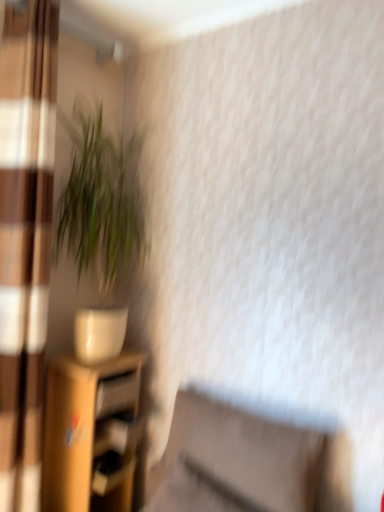
Question: From a real-world perspective, is green leafy plant at left under wooden shelf at lower left?

Choices:
 (A) no
 (B) yes

Answer: (A)

Question: From the image's perspective, does green leafy plant at left appear higher than wooden shelf at lower left?

Choices:
 (A) yes
 (B) no

Answer: (A)

Question: Is green leafy plant at left to the left of wooden shelf at lower left from the viewer's perspective?

Choices:
 (A) yes
 (B) no

Answer: (B)

Question: Is green leafy plant at left outside of wooden shelf at lower left?

Choices:
 (A) no
 (B) yes

Answer: (B)

Question: Is green leafy plant at left looking in the opposite direction of wooden shelf at lower left?

Choices:
 (A) no
 (B) yes

Answer: (A)

Question: Is green leafy plant at left bigger than wooden shelf at lower left?

Choices:
 (A) yes
 (B) no

Answer: (B)

Question: Considering the relative sizes of wooden drawer at lower left and matte brown swivel chair at lower center in the image provided, is wooden drawer at lower left taller than matte brown swivel chair at lower center?

Choices:
 (A) yes
 (B) no

Answer: (B)

Question: Does wooden drawer at lower left have a lesser height compared to matte brown swivel chair at lower center?

Choices:
 (A) yes
 (B) no

Answer: (A)

Question: Is wooden drawer at lower left outside matte brown swivel chair at lower center?

Choices:
 (A) no
 (B) yes

Answer: (B)

Question: From the image's perspective, would you say wooden drawer at lower left is positioned over matte brown swivel chair at lower center?

Choices:
 (A) no
 (B) yes

Answer: (B)

Question: Does wooden drawer at lower left turn towards matte brown swivel chair at lower center?

Choices:
 (A) no
 (B) yes

Answer: (B)

Question: Can you confirm if wooden drawer at lower left is positioned to the right of matte brown swivel chair at lower center?

Choices:
 (A) yes
 (B) no

Answer: (B)

Question: Does matte brown swivel chair at lower center contain wooden drawer at lower left?

Choices:
 (A) yes
 (B) no

Answer: (B)